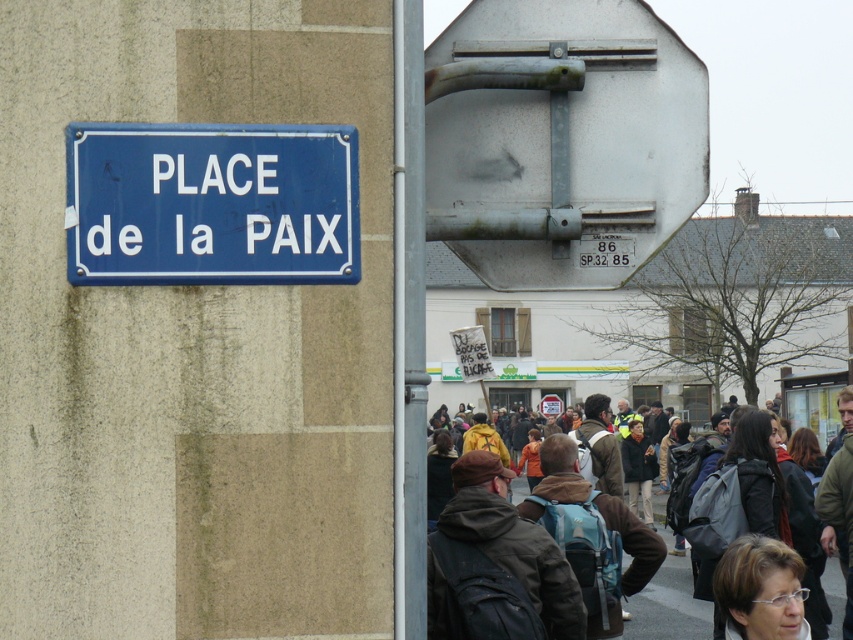
Is point (532, 266) less distant than point (659, 497)?

Yes, point (532, 266) is in front of point (659, 497).

Does rusty metal basketball hoop at upper center lie in front of dark brown leather jacket at center?

Yes, rusty metal basketball hoop at upper center is in front of dark brown leather jacket at center.

Image resolution: width=853 pixels, height=640 pixels. What do you see at coordinates (561, 140) in the screenshot?
I see `rusty metal basketball hoop at upper center` at bounding box center [561, 140].

Where is `rusty metal basketball hoop at upper center`? The height and width of the screenshot is (640, 853). rusty metal basketball hoop at upper center is located at coordinates (561, 140).

Who is lower down, matte black glasses at lower right or dark brown leather jacket at center?

dark brown leather jacket at center is lower down.

Between point (758, 604) and point (641, 509), which one is positioned in front?

Point (758, 604)

Locate an element on the screen. This screenshot has height=640, width=853. matte black glasses at lower right is located at coordinates (759, 588).

Which is below, blue painted metal sign at upper left or dark brown leather jacket at center?

dark brown leather jacket at center is below.

Is point (337, 260) closer to viewer compared to point (842, 568)?

Yes, point (337, 260) is in front of point (842, 568).

Locate an element on the screen. The width and height of the screenshot is (853, 640). blue painted metal sign at upper left is located at coordinates (212, 204).